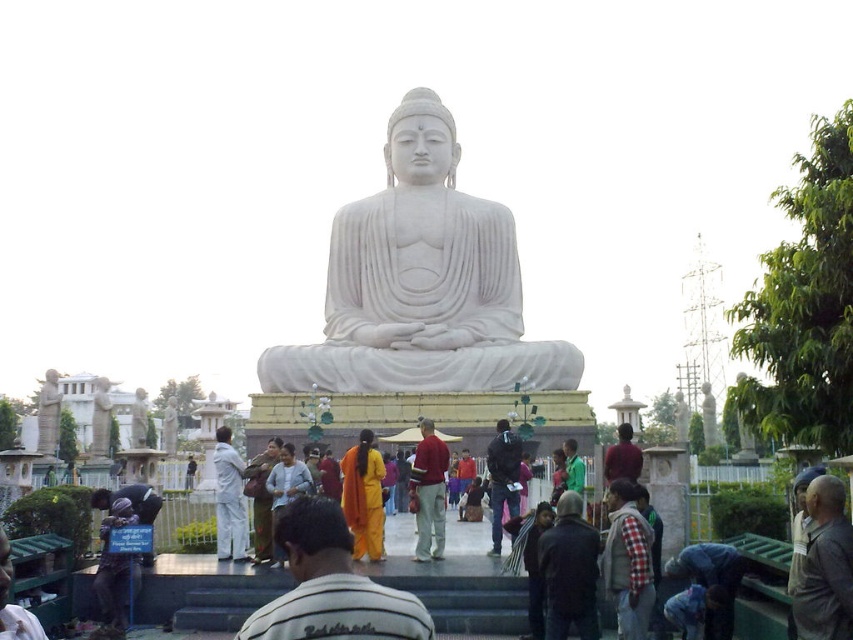
Based on the photo, you are a visitor standing at the base of the steps leading to the white marble statue at center. You notice the brown textured cloth at lower right nearby. Which object is higher in elevation?

The white marble statue at center is positioned over the brown textured cloth at lower right, so the statue is higher in elevation than the cloth.

You are a tour guide leading a group to the white marble statue at center. You notice a brown textured cloth at lower right nearby. Can you confirm if the statue is wider than the cloth?

The white marble statue at center might be wider than brown textured cloth at lower right according to the description.